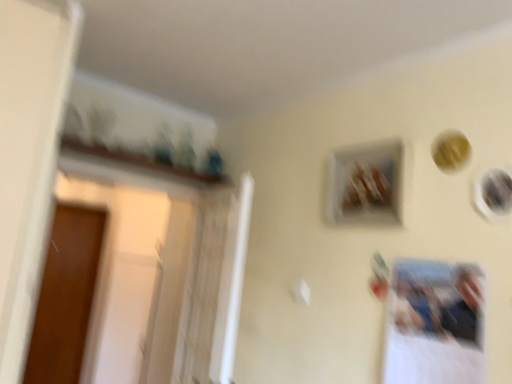
Question: Is brown wood screen door at left in front of or behind matte black picture frame at upper right, the 2th picture frame viewed from the left, in the image?

Choices:
 (A) front
 (B) behind

Answer: (B)

Question: Is point (33, 332) positioned closer to the camera than point (487, 211)?

Choices:
 (A) closer
 (B) farther

Answer: (B)

Question: Considering the real-world distances, which object is farthest from the brown wood screen door at left?

Choices:
 (A) matte black picture frame at upper right, arranged as the first picture frame when viewed from the right
 (B) wooden frame at upper center, the 2th picture frame from the right

Answer: (A)

Question: Which object is the closest to the brown wood screen door at left?

Choices:
 (A) matte black picture frame at upper right, the 2th picture frame viewed from the left
 (B) wooden frame at upper center, the 1th picture frame from the back

Answer: (B)